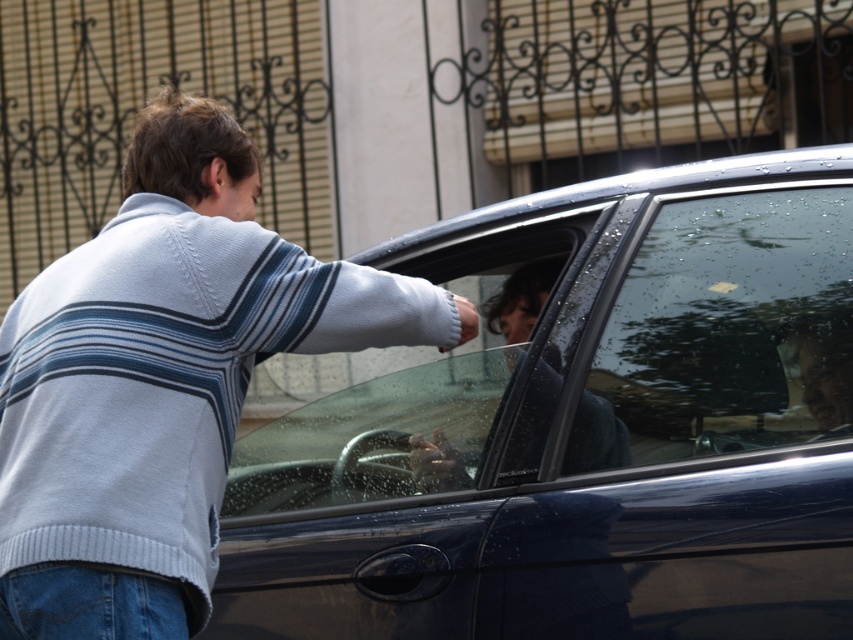
Can you confirm if light blue sweater at center is positioned above transparent glass car window at center?

Correct, light blue sweater at center is located above transparent glass car window at center.

Does point (329, 316) come in front of point (479, 284)?

Yes.

Describe the element at coordinates (161, 380) in the screenshot. I see `light blue sweater at center` at that location.

I want to click on light blue sweater at center, so click(x=161, y=380).

How much distance is there between glossy dark blue car at center and light blue sweater at center?

glossy dark blue car at center is 15.62 inches away from light blue sweater at center.

Does glossy dark blue car at center have a smaller size compared to light blue sweater at center?

Actually, glossy dark blue car at center might be larger than light blue sweater at center.

The width and height of the screenshot is (853, 640). Describe the element at coordinates (582, 428) in the screenshot. I see `glossy dark blue car at center` at that location.

You are a GUI agent. You are given a task and a screenshot of the screen. Output one action in this format:
    pyautogui.click(x=<x>, y=<y>)
    Task: Click on the glossy dark blue car at center
    This screenshot has width=853, height=640.
    Given the screenshot: What is the action you would take?
    pyautogui.click(x=582, y=428)

Who is more forward, (764, 362) or (524, 432)?

Point (764, 362) is in front.

Can you confirm if transparent glass windshield at center is bigger than transparent glass car window at center?

No.

Which is behind, point (631, 416) or point (451, 486)?

Positioned behind is point (451, 486).

This screenshot has width=853, height=640. What are the coordinates of `transparent glass windshield at center` in the screenshot? It's located at (724, 332).